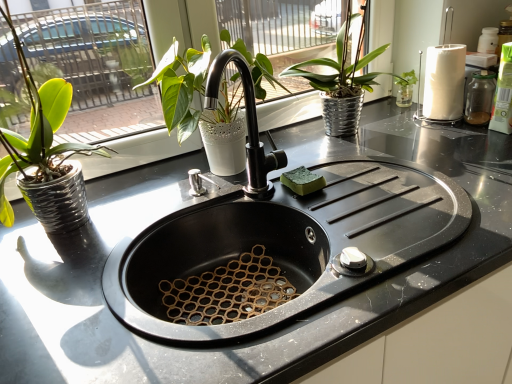
Question: Is green matte plant at left, placed as the 1th houseplant when sorted from left to right, oriented away from metallic silver pot at upper center, positioned as the 3th houseplant in left-to-right order?

Choices:
 (A) no
 (B) yes

Answer: (A)

Question: Is green matte plant at left, placed as the 1th houseplant when sorted from left to right, facing towards metallic silver pot at upper center, positioned as the 3th houseplant in left-to-right order?

Choices:
 (A) no
 (B) yes

Answer: (A)

Question: Is green matte plant at left, placed as the 1th houseplant when sorted from left to right, in front of metallic silver pot at upper center, positioned as the 3th houseplant in left-to-right order?

Choices:
 (A) no
 (B) yes

Answer: (B)

Question: Is green matte plant at left, placed as the third houseplant when sorted from right to left, outside metallic silver pot at upper center, positioned as the 3th houseplant in left-to-right order?

Choices:
 (A) yes
 (B) no

Answer: (A)

Question: Is green matte plant at left, placed as the third houseplant when sorted from right to left, further to camera compared to metallic silver pot at upper center, which is the first houseplant from right to left?

Choices:
 (A) no
 (B) yes

Answer: (A)

Question: From a real-world perspective, is green matte plant at left, placed as the 1th houseplant when sorted from left to right, located beneath metallic silver pot at upper center, positioned as the 3th houseplant in left-to-right order?

Choices:
 (A) no
 (B) yes

Answer: (A)

Question: Is metallic silver pot at upper center, which is the first houseplant from right to left, to the right of green matte plant at left, placed as the third houseplant when sorted from right to left, from the viewer's perspective?

Choices:
 (A) no
 (B) yes

Answer: (B)

Question: From a real-world perspective, is metallic silver pot at upper center, positioned as the 3th houseplant in left-to-right order, positioned under green matte plant at left, placed as the 1th houseplant when sorted from left to right, based on gravity?

Choices:
 (A) yes
 (B) no

Answer: (A)

Question: Is metallic silver pot at upper center, which is the first houseplant from right to left, surrounding green matte plant at left, placed as the third houseplant when sorted from right to left?

Choices:
 (A) no
 (B) yes

Answer: (A)

Question: From the image's perspective, is metallic silver pot at upper center, positioned as the 3th houseplant in left-to-right order, on green matte plant at left, placed as the third houseplant when sorted from right to left?

Choices:
 (A) yes
 (B) no

Answer: (A)

Question: Considering the relative sizes of metallic silver pot at upper center, positioned as the 3th houseplant in left-to-right order, and green matte plant at left, placed as the 1th houseplant when sorted from left to right, in the image provided, is metallic silver pot at upper center, positioned as the 3th houseplant in left-to-right order, wider than green matte plant at left, placed as the 1th houseplant when sorted from left to right,?

Choices:
 (A) yes
 (B) no

Answer: (B)

Question: From a real-world perspective, is metallic silver pot at upper center, which is the first houseplant from right to left, on top of green matte plant at left, placed as the 1th houseplant when sorted from left to right?

Choices:
 (A) yes
 (B) no

Answer: (B)

Question: Does metallic silver pot at upper center, positioned as the 3th houseplant in left-to-right order, appear on the right side of matte white pot at upper center, the 2th houseplant when ordered from right to left?

Choices:
 (A) no
 (B) yes

Answer: (B)